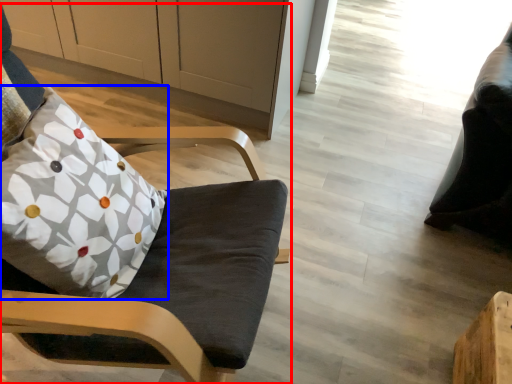
Question: Which of the following is the farthest to the observer, chair (highlighted by a red box) or pillow (highlighted by a blue box)?

Choices:
 (A) chair
 (B) pillow

Answer: (B)